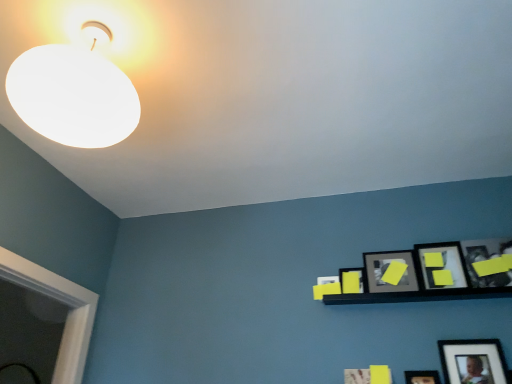
This screenshot has height=384, width=512. Find the location of `free point above white matte lampshade at upper left (from a real-world perspective)`. free point above white matte lampshade at upper left (from a real-world perspective) is located at coordinates (106, 29).